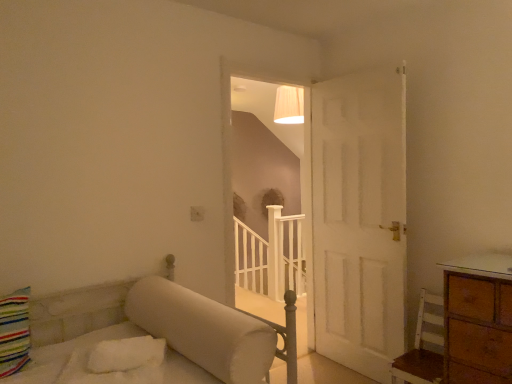
Find the location of `white matte staircase at center`. white matte staircase at center is located at coordinates (267, 111).

From the picture: What is the approximate height of white matte staircase at center?

6.79 feet.

Measure the distance between white wooden balustrade at center and camera.

white wooden balustrade at center and camera are 3.72 meters apart.

You are a GUI agent. You are given a task and a screenshot of the screen. Output one action in this format:
    pyautogui.click(x=<x>, y=<y>)
    Task: Click on the white wood chair at lower right
    This screenshot has height=384, width=512.
    Given the screenshot: What is the action you would take?
    pyautogui.click(x=422, y=349)

Where is `white matte staircase at center`? white matte staircase at center is located at coordinates (267, 111).

Considering the relative sizes of white wooden balustrade at center and white matte staircase at center in the image provided, is white wooden balustrade at center thinner than white matte staircase at center?

No, white wooden balustrade at center is not thinner than white matte staircase at center.

How much distance is there between white wooden balustrade at center and white matte staircase at center?

white wooden balustrade at center and white matte staircase at center are 1.46 meters apart from each other.

Does white wooden balustrade at center lie behind white matte staircase at center?

Yes, white wooden balustrade at center is further from the camera.

Looking at this image, are white wooden balustrade at center and white matte staircase at center making contact?

They are not placed beside each other.

Between white wooden balustrade at center and white wood chair at lower right, which one has larger size?

white wooden balustrade at center is bigger.

From a real-world perspective, who is located lower, white wooden balustrade at center or white wood chair at lower right?

In real-world perspective, white wooden balustrade at center is lower.

Considering the positions of point (260, 255) and point (408, 356), is point (260, 255) closer or farther from the camera than point (408, 356)?

Point (260, 255) is positioned farther from the camera compared to point (408, 356).

Considering the sizes of white wooden balustrade at center and white wood chair at lower right in the image, is white wooden balustrade at center taller or shorter than white wood chair at lower right?

white wooden balustrade at center is taller than white wood chair at lower right.

Is white wood chair at lower right positioned behind white wooden balustrade at center?

No, white wood chair at lower right is closer to the camera.

Based on their positions, is white wood chair at lower right located to the left or right of white wooden balustrade at center?

white wood chair at lower right is to the right of white wooden balustrade at center.

Find the location of a particular element. balustrade behind the white wood chair at lower right is located at coordinates (271, 256).

Which point is more distant from viewer, (405,359) or (241,221)?

The point (241,221) is farther from the camera.

Could you tell me if white matte staircase at center is turned towards white wooden balustrade at center?

No, white matte staircase at center is not facing towards white wooden balustrade at center.

Is white matte staircase at center situated inside white wooden balustrade at center or outside?

white matte staircase at center is not enclosed by white wooden balustrade at center.

In terms of size, does white matte staircase at center appear bigger or smaller than white wooden balustrade at center?

Clearly, white matte staircase at center is smaller in size than white wooden balustrade at center.

Between white matte staircase at center and white wooden balustrade at center, which one appears on the right side from the viewer's perspective?

white wooden balustrade at center is more to the right.

Is white matte staircase at center facing towards white wood chair at lower right?

Yes, white matte staircase at center is oriented towards white wood chair at lower right.

The image size is (512, 384). In order to click on window above the white wood chair at lower right (from a real-world perspective) in this screenshot , I will do `click(267, 111)`.

From the image's perspective, is white matte staircase at center located beneath white wood chair at lower right?

Actually, white matte staircase at center appears above white wood chair at lower right in the image.

Considering the sizes of objects white matte staircase at center and white wood chair at lower right in the image provided, who is taller, white matte staircase at center or white wood chair at lower right?

With more height is white matte staircase at center.

Does white wood chair at lower right have a lesser height compared to white matte staircase at center?

Yes.

From the image's perspective, is white wood chair at lower right above or below white matte staircase at center?

white wood chair at lower right is situated lower than white matte staircase at center in the image.

In terms of size, does white wood chair at lower right appear bigger or smaller than white matte staircase at center?

In the image, white wood chair at lower right appears to be smaller than white matte staircase at center.

Considering the sizes of white wood chair at lower right and white matte staircase at center in the image, is white wood chair at lower right wider or thinner than white matte staircase at center?

In the image, white wood chair at lower right appears to be wider than white matte staircase at center.

Locate an element on the screen. balustrade on the right of the white matte staircase at center is located at coordinates (271, 256).

Locate an element on the screen. This screenshot has width=512, height=384. balustrade that appears behind the white wood chair at lower right is located at coordinates (271, 256).

Looking at the image, which one is located closer to white wood chair at lower right, white matte staircase at center or white wooden balustrade at center?

white wooden balustrade at center is closer to white wood chair at lower right.

When comparing their distances from white wooden balustrade at center, does white matte staircase at center or white wood chair at lower right seem further?

Among the two, white wood chair at lower right is located further to white wooden balustrade at center.

From the image, which object appears to be farther from white wood chair at lower right, white wooden balustrade at center or white matte staircase at center?

Among the two, white matte staircase at center is located further to white wood chair at lower right.

Considering their positions, is white wood chair at lower right positioned further to white matte staircase at center than white wooden balustrade at center?

white wood chair at lower right is positioned further to the anchor white matte staircase at center.

When comparing their distances from white matte staircase at center, does white wooden balustrade at center or white wood chair at lower right seem further?

white wood chair at lower right is further to white matte staircase at center.

Consider the image. When comparing their distances from white wooden balustrade at center, does white wood chair at lower right or white matte staircase at center seem closer?

Based on the image, white matte staircase at center appears to be nearer to white wooden balustrade at center.

Find the location of a particular element. The height and width of the screenshot is (384, 512). window between white wood chair at lower right and white wooden balustrade at center in the front-back direction is located at coordinates (267, 111).